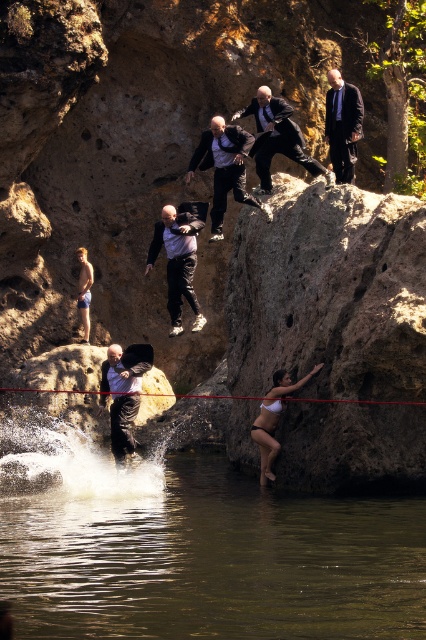
Question: Can you confirm if brown murky water at lower left is positioned to the left of black matte pants at lower left?

Choices:
 (A) no
 (B) yes

Answer: (A)

Question: Is matte black suit at upper center in front of white matte bikini at lower center?

Choices:
 (A) no
 (B) yes

Answer: (A)

Question: Does black leather pants at center have a lesser width compared to smooth skin person at lower left?

Choices:
 (A) no
 (B) yes

Answer: (A)

Question: Which object is closer to the camera taking this photo?

Choices:
 (A) red nylon rope at lower center
 (B) black leather pants at center
 (C) black matte pants at lower left
 (D) dark blue suit at upper center

Answer: (A)

Question: Which object is positioned farthest from the dark gray suit at center?

Choices:
 (A) smooth skin person at lower left
 (B) black matte pants at lower left
 (C) matte black suit at upper center

Answer: (A)

Question: Based on their relative distances, which object is nearer to the brown murky water at lower left?

Choices:
 (A) dark gray suit at center
 (B) black matte pants at lower left
 (C) matte black suit at upper center
 (D) red nylon rope at lower center

Answer: (D)